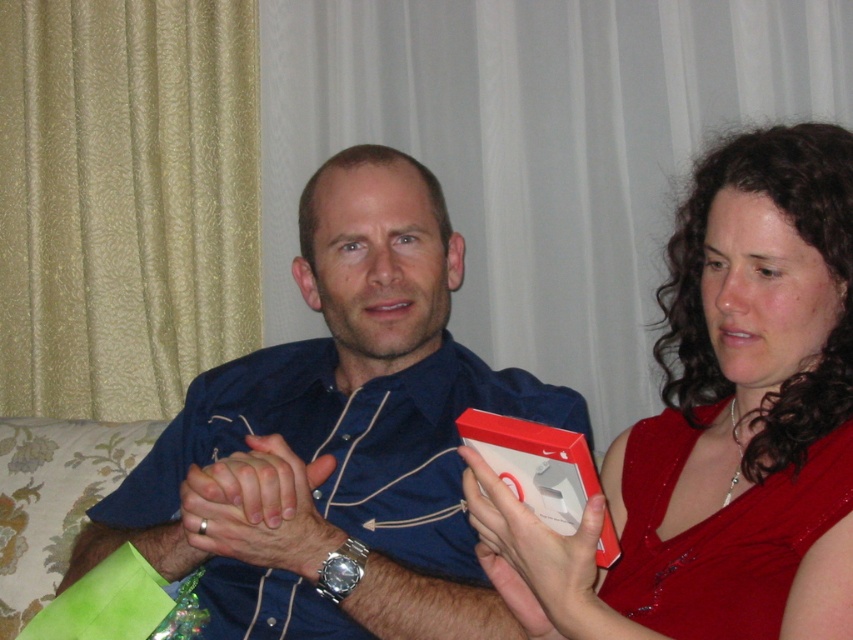
Question: Is blue satin shirt at center to the right of matte blue shirt at center from the viewer's perspective?

Choices:
 (A) yes
 (B) no

Answer: (A)

Question: Is shiny red dress at upper right further to camera compared to matte blue shirt at center?

Choices:
 (A) yes
 (B) no

Answer: (B)

Question: Which point is closer to the camera?

Choices:
 (A) matte blue shirt at center
 (B) matte white box at center
 (C) blue satin shirt at center

Answer: (B)

Question: Which point is closer to the camera?

Choices:
 (A) blue satin shirt at center
 (B) shiny red dress at upper right
 (C) matte blue shirt at center

Answer: (B)

Question: Among these objects, which one is farthest from the camera?

Choices:
 (A) blue satin shirt at center
 (B) shiny red dress at upper right
 (C) matte blue shirt at center

Answer: (A)

Question: Can you confirm if blue satin shirt at center is thinner than shiny red dress at upper right?

Choices:
 (A) yes
 (B) no

Answer: (B)